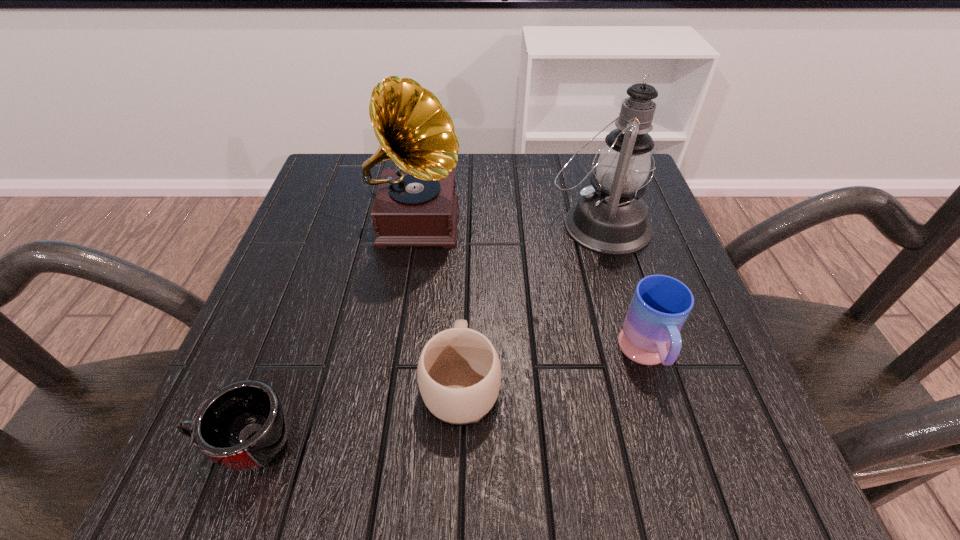
Locate an element on the screen. blank area located on the side of the second mug from left to right with the handle is located at coordinates (467, 202).

I want to click on blank space located 0.390m on the side of the second mug from left to right with the handle, so click(467, 202).

What are the coordinates of `oil lamp present at the far edge` in the screenshot? It's located at (610, 218).

Find the location of a particular element. The width and height of the screenshot is (960, 540). phonograph record that is at the far edge is located at coordinates (416, 205).

Identify the location of object present at the near edge. (243, 426).

Identify the location of phonograph record that is at the left edge. Image resolution: width=960 pixels, height=540 pixels. (416, 205).

Where is `mug situated at the left edge`? Image resolution: width=960 pixels, height=540 pixels. mug situated at the left edge is located at coordinates (243, 426).

Where is `oil lamp positioned at the right edge`? oil lamp positioned at the right edge is located at coordinates (610, 218).

I want to click on mug located in the right edge section of the desktop, so click(x=660, y=306).

Identify the location of object that is at the far left corner. (416, 205).